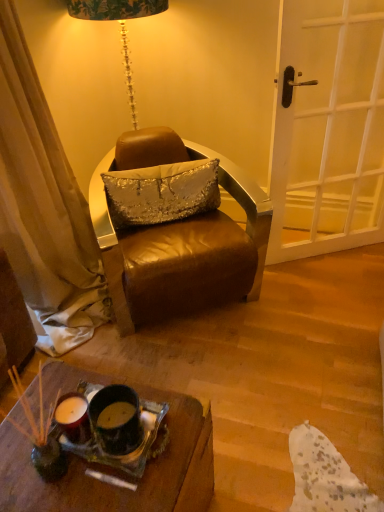
Question: From a real-world perspective, is translucent glass tray at lower center above or below silver sequined pillow at center?

Choices:
 (A) below
 (B) above

Answer: (B)

Question: Based on their sizes in the image, would you say translucent glass tray at lower center is bigger or smaller than silver sequined pillow at center?

Choices:
 (A) big
 (B) small

Answer: (B)

Question: Estimate the real-world distances between objects in this image. Which object is closer to the translucent glass tray at lower center?

Choices:
 (A) silver sequined pillow at center
 (B) leather chair at center
 (C) white wooden door at right

Answer: (B)

Question: Which is nearer to the silver sequined pillow at center?

Choices:
 (A) leather chair at center
 (B) white wooden door at right
 (C) translucent glass tray at lower center

Answer: (A)